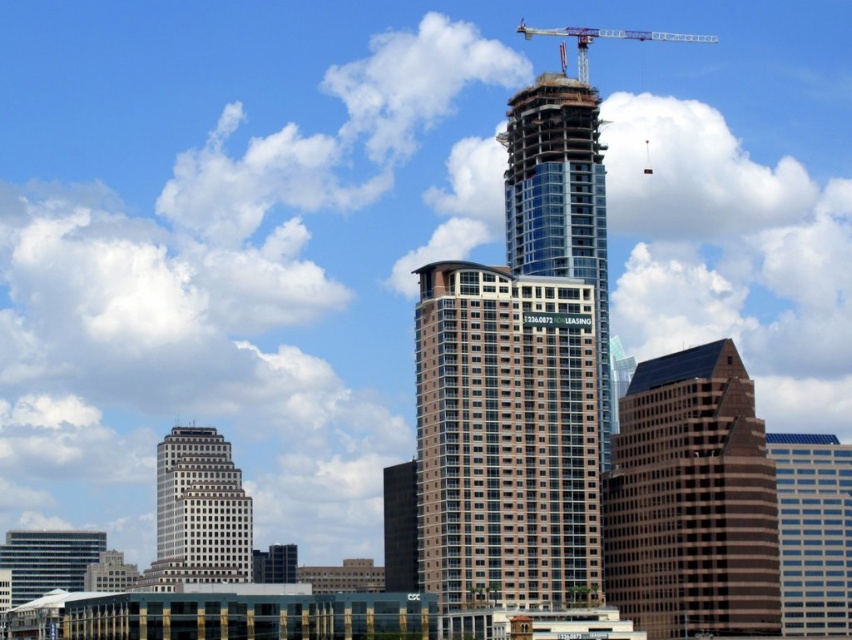
Question: Is brown glassy building at center closer to the viewer compared to clear glass skyscraper at center?

Choices:
 (A) no
 (B) yes

Answer: (B)

Question: Among these objects, which one is farthest from the camera?

Choices:
 (A) brown glassy building at center
 (B) blue glass skyscraper at center

Answer: (B)

Question: Is clear glass skyscraper at center wider than metallic silver crane at upper center?

Choices:
 (A) no
 (B) yes

Answer: (A)

Question: Does brown glassy building at center have a greater width compared to brown glassy building at center-right?

Choices:
 (A) yes
 (B) no

Answer: (A)

Question: Among these objects, which one is farthest from the camera?

Choices:
 (A) metallic silver crane at upper center
 (B) blue glass skyscraper at center
 (C) brown glassy building at center-right

Answer: (A)

Question: Which is nearer to the metallic silver crane at upper center?

Choices:
 (A) white glass building at lower left
 (B) blue glass skyscraper at center

Answer: (B)